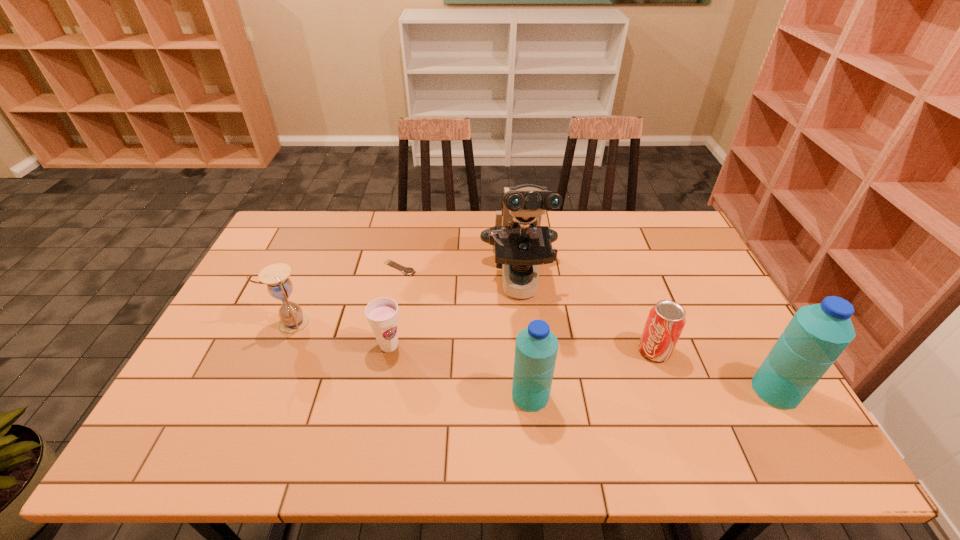
Locate an element on the screen. Image resolution: width=960 pixels, height=540 pixels. vacant space at the far edge of the desktop is located at coordinates (575, 213).

Identify the location of vacant point at the near edge. Image resolution: width=960 pixels, height=540 pixels. (678, 410).

What are the coordinates of `free spot at the left edge of the desktop` in the screenshot? It's located at (250, 275).

Identify the location of vacant area at the right edge of the desktop. Image resolution: width=960 pixels, height=540 pixels. (694, 270).

Where is `blank space at the far left corner`? blank space at the far left corner is located at coordinates (296, 215).

In the image, there is a desktop. Find the location of `vacant space at the far right corner`. vacant space at the far right corner is located at coordinates (686, 237).

Where is `free space between the shorter water bottle and the shortest object`? free space between the shorter water bottle and the shortest object is located at coordinates [465, 332].

What are the coordinates of `vacant area that lies between the right water bottle and the shorter water bottle` in the screenshot? It's located at (653, 393).

The width and height of the screenshot is (960, 540). I want to click on unoccupied position between the shortest object and the microscope, so click(460, 275).

This screenshot has height=540, width=960. What are the coordinates of `vacant region between the soda can and the leftmost object` in the screenshot? It's located at (473, 337).